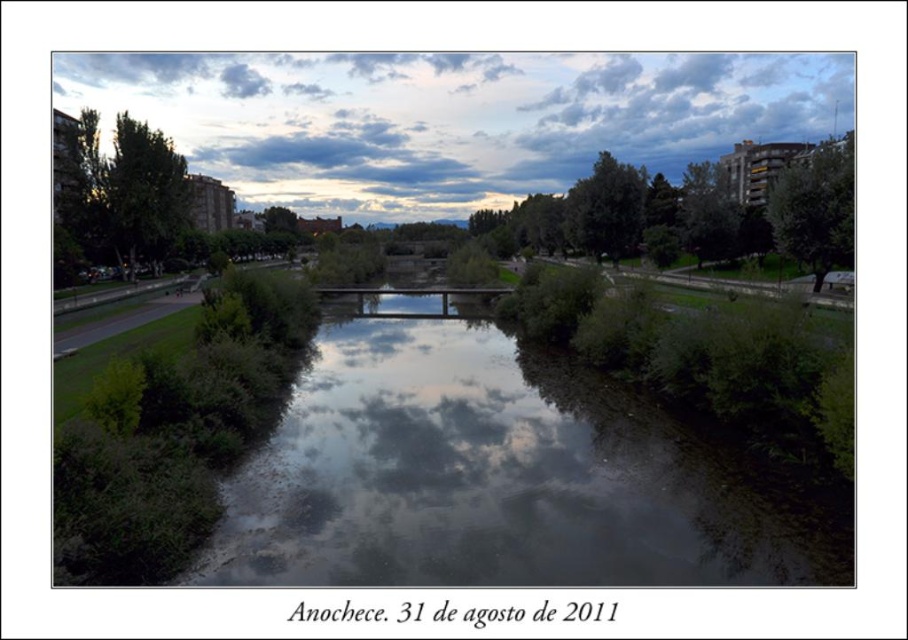
Question: Does green leafy river at center have a lesser width compared to cloudy sky at upper center?

Choices:
 (A) yes
 (B) no

Answer: (A)

Question: Which of the following is the closest to the observer?

Choices:
 (A) green leafy river at center
 (B) cloudy sky at upper center

Answer: (A)

Question: In this image, where is green leafy river at center located relative to cloudy sky at upper center?

Choices:
 (A) below
 (B) above

Answer: (A)

Question: Among these points, which one is farthest from the camera?

Choices:
 (A) (x=397, y=134)
 (B) (x=460, y=396)

Answer: (A)

Question: Does green leafy river at center appear on the right side of cloudy sky at upper center?

Choices:
 (A) no
 (B) yes

Answer: (B)

Question: Which of the following is the closest to the observer?

Choices:
 (A) (745, 129)
 (B) (430, 490)

Answer: (B)